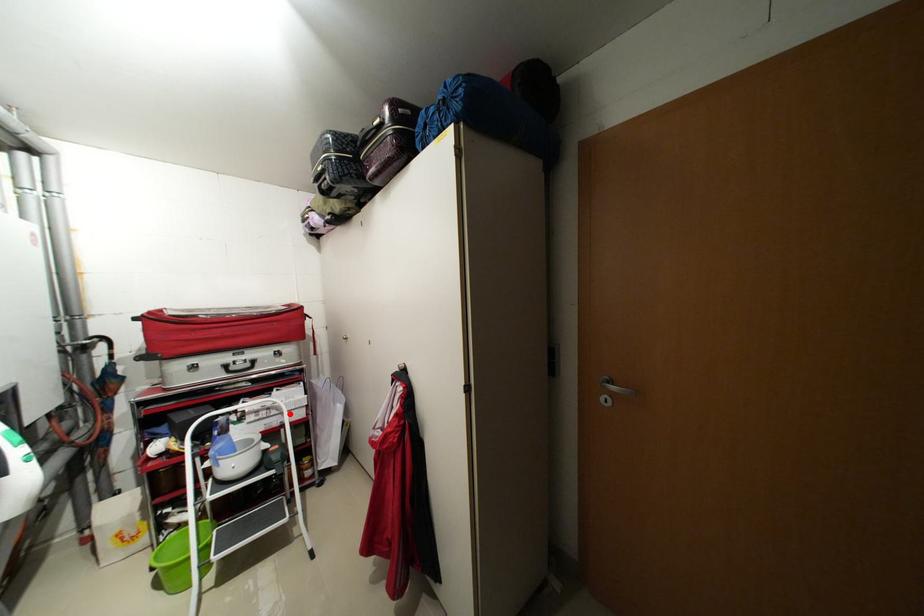
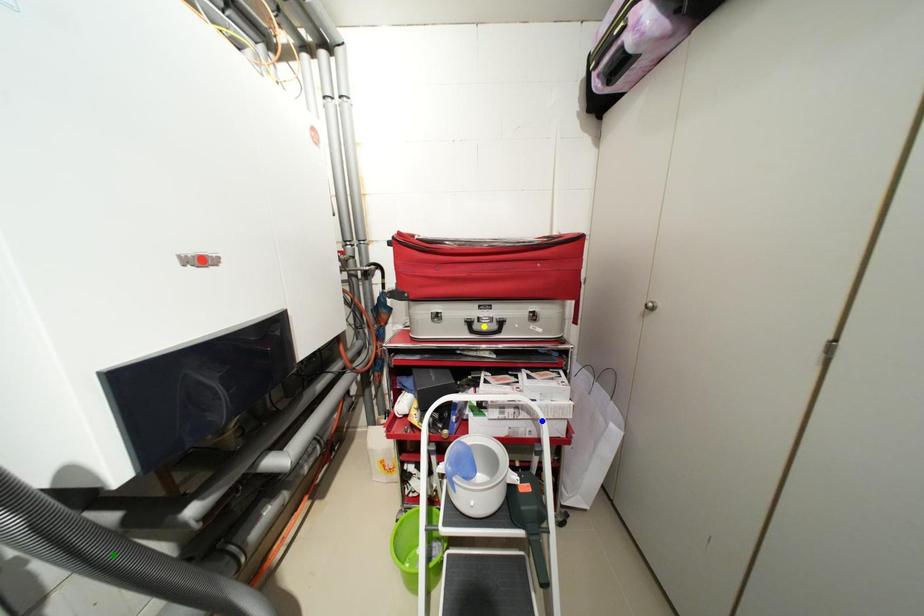
Question: I am providing you with two images of the same scene from different viewpoints. A red point is marked on the first image. You are given multiple points on the second image. Which mark in image 2 goes with the point in image 1?

Choices:
 (A) green point
 (B) yellow point
 (C) blue point

Answer: (C)